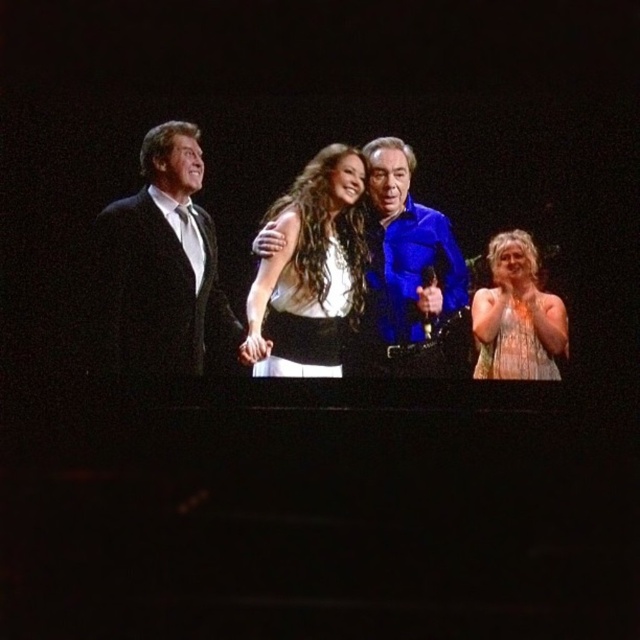
In the image of the group on stage, there are two people wearing the black satin suit at left and the white satin dress at center. Which one is positioned to the left of the other?

The black satin suit at left is positioned to the left of the white satin dress at center.

You are a photographer at the event and need to adjust the lighting so that both the black satin suit at left and white satin dress at center are equally illuminated. Considering their heights, which one might require a higher light stand to achieve proper exposure?

The black satin suit at left is much taller than the white satin dress at center, so the light stand for the black satin suit at left should be positioned higher to account for its greater height and ensure even illumination.

You are a photographer setting up for a group photo. You need to ensure that the black satin suit at left and the black satin dress at center are both fully visible in the frame. Based on their positions and the scene description, which object might require more space to accommodate its width?

The black satin suit at left might be wider than the black satin dress at center, so it might require more space to accommodate its width.